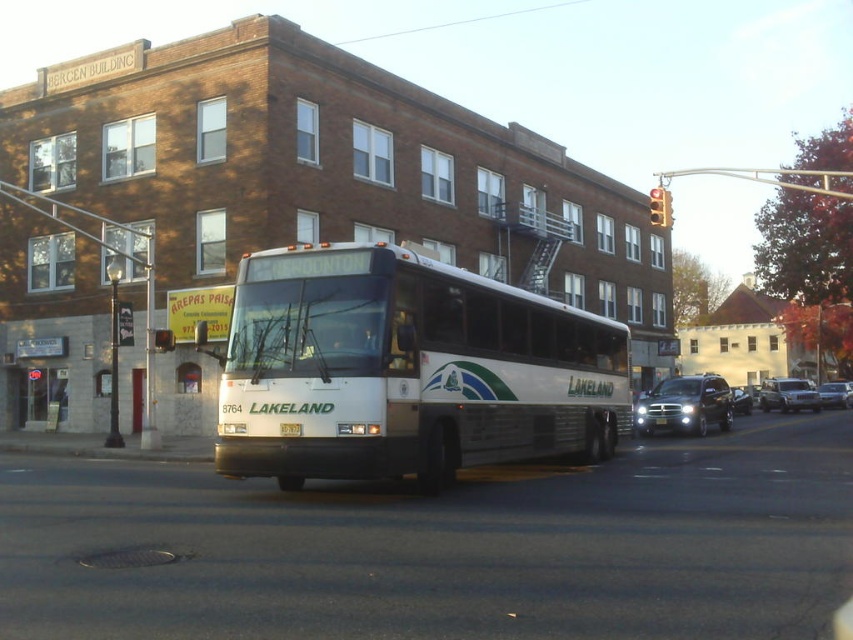
Is shiny silver sedan at center positioned before yellow metallic license plate at center?

No, shiny silver sedan at center is behind yellow metallic license plate at center.

Does point (732, 410) come behind point (659, 420)?

Yes, point (732, 410) is farther from viewer.

Between point (735, 412) and point (659, 424), which one is positioned in front?

Point (659, 424)

In order to click on shiny silver sedan at center in this screenshot , I will do `click(740, 401)`.

Does point (726, 422) lie in front of point (666, 420)?

No, (726, 422) is further to viewer.

This screenshot has width=853, height=640. In order to click on satin black suv at center in this screenshot , I will do `click(686, 404)`.

Is point (653, 412) positioned behind point (659, 420)?

That is True.

Locate an element on the screen. satin black suv at center is located at coordinates (686, 404).

Who is positioned more to the left, silver metallic sedan at right or metallic traffic light at center?

metallic traffic light at center

Can you confirm if silver metallic sedan at right is bigger than metallic traffic light at center?

Yes.

Between point (791, 404) and point (167, 344), which one is positioned behind?

The point (791, 404) is behind.

Where is `silver metallic sedan at right`? Image resolution: width=853 pixels, height=640 pixels. silver metallic sedan at right is located at coordinates (787, 394).